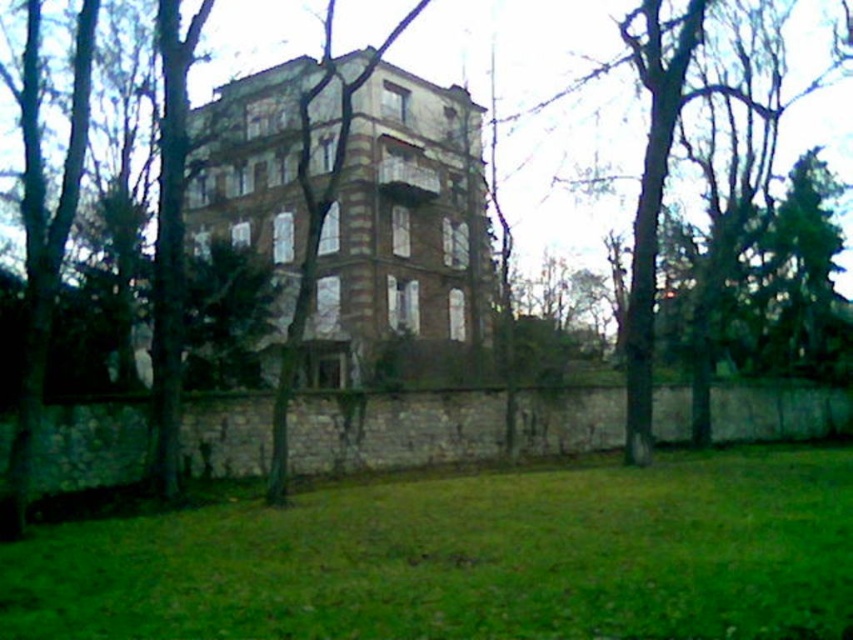
Is point (296, 576) in front of point (286, 483)?

Yes.

Does green grass at lower center appear on the left side of brown textured building at center?

Incorrect, green grass at lower center is not on the left side of brown textured building at center.

Where is `green grass at lower center`? This screenshot has width=853, height=640. green grass at lower center is located at coordinates (467, 557).